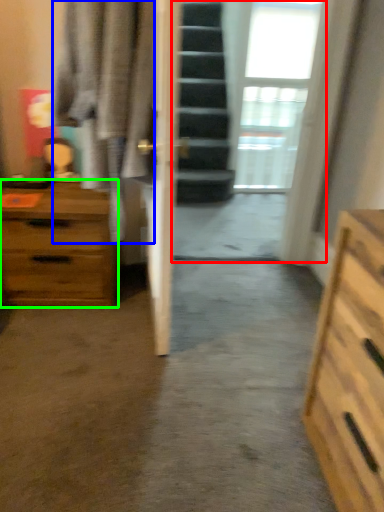
Question: Which object is the closest to the glass door (highlighted by a red box)? Choose among these: robe (highlighted by a blue box) or chest of drawers (highlighted by a green box).

Choices:
 (A) robe
 (B) chest of drawers

Answer: (B)